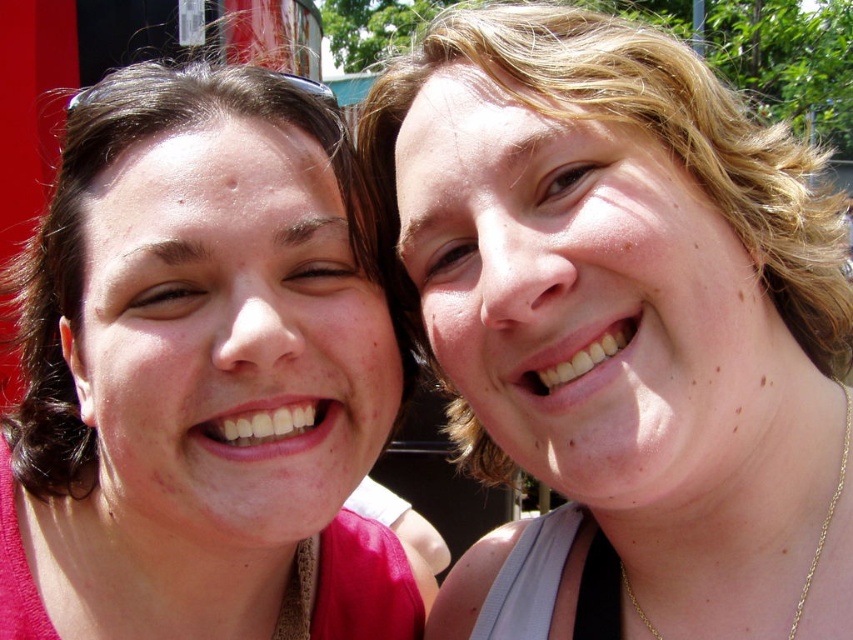
Is matte skin at center below matte pink shirt at left?

Incorrect, matte skin at center is not positioned below matte pink shirt at left.

Is matte skin at center shorter than matte pink shirt at left?

No, matte skin at center is not shorter than matte pink shirt at left.

Where is `matte skin at center`? The image size is (853, 640). matte skin at center is located at coordinates (622, 330).

Locate an element on the screen. matte skin at center is located at coordinates (622, 330).

Between point (386, 368) and point (788, 636), which one is positioned in front?

Positioned in front is point (788, 636).

Does matte pink shirt at left have a larger size compared to gold chain at lower right?

Yes, matte pink shirt at left is bigger than gold chain at lower right.

Measure the distance between matte pink shirt at left and camera.

matte pink shirt at left and camera are 3.80 feet apart.

Image resolution: width=853 pixels, height=640 pixels. Identify the location of matte pink shirt at left. (200, 376).

Looking at this image, is matte skin at center behind gold chain at lower right?

No, matte skin at center is in front of gold chain at lower right.

Is matte skin at center positioned in front of gold chain at lower right?

Yes, matte skin at center is closer to the viewer.

Between point (717, 323) and point (648, 628), which one is positioned in front?

Point (717, 323) is in front.

I want to click on matte skin at center, so click(622, 330).